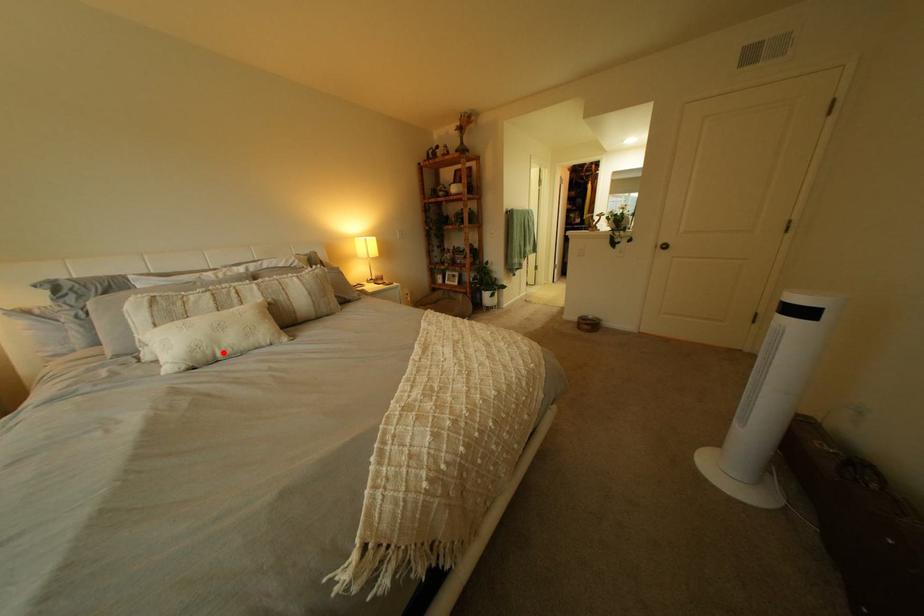
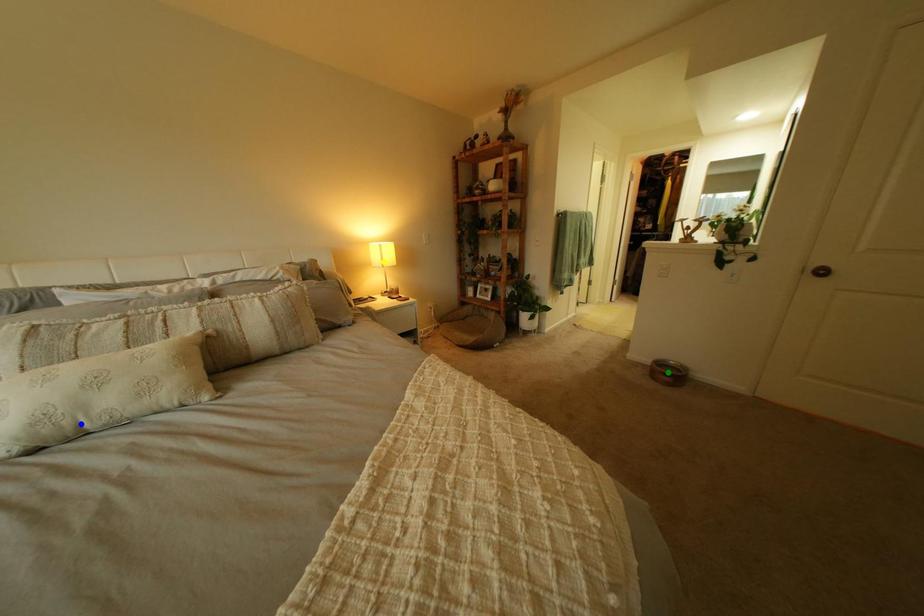
Question: I am providing you with two images of the same scene from different viewpoints. A red point is marked on the first image. You are given multiple points on the second image. Which mark in image 2 goes with the point in image 1?

Choices:
 (A) blue point
 (B) green point
 (C) yellow point

Answer: (A)